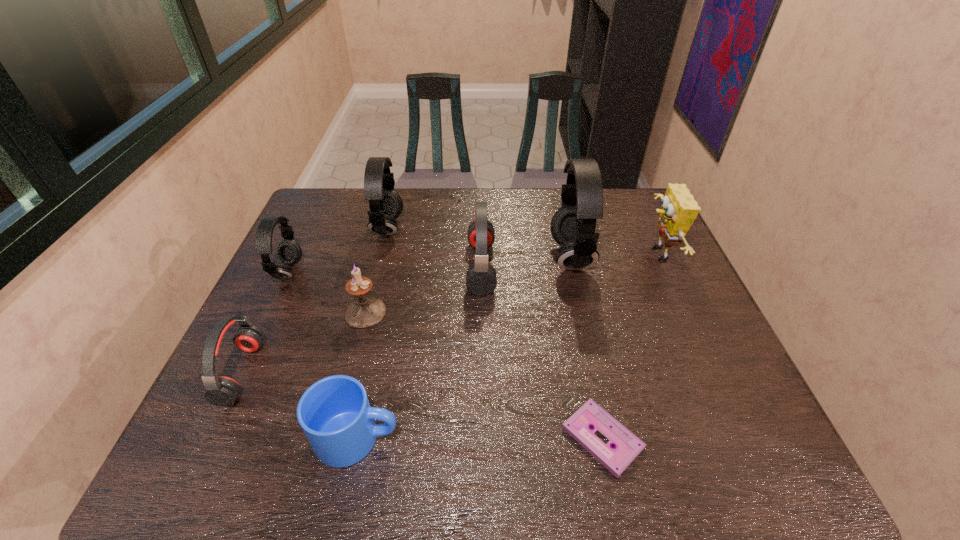
Locate an element on the screen. The image size is (960, 540). the tallest object is located at coordinates (573, 225).

This screenshot has width=960, height=540. In order to click on the biggest black earphone in this screenshot , I will do click(573, 225).

Image resolution: width=960 pixels, height=540 pixels. What are the coordinates of `the fourth shortest earphone` in the screenshot? It's located at (386, 205).

You are a GUI agent. You are given a task and a screenshot of the screen. Output one action in this format:
    pyautogui.click(x=<x>, y=<y>)
    Task: Click on the second smallest black earphone
    
    Given the screenshot: What is the action you would take?
    pyautogui.click(x=386, y=205)

Where is `yellow sponge`? yellow sponge is located at coordinates (679, 209).

Where is `the rightmost object`? the rightmost object is located at coordinates (679, 209).

This screenshot has width=960, height=540. What are the coordinates of `the right red earphone` in the screenshot? It's located at (481, 280).

You are a GUI agent. You are given a task and a screenshot of the screen. Output one action in this format:
    pyautogui.click(x=<x>, y=<y>)
    Task: Click on the sixth object from left to right
    The image size is (960, 540).
    Given the screenshot: What is the action you would take?
    pos(481,280)

You are a GUI agent. You are given a task and a screenshot of the screen. Output one action in this format:
    pyautogui.click(x=<x>, y=<y>)
    Task: Click on the smallest black earphone
    
    Given the screenshot: What is the action you would take?
    pyautogui.click(x=289, y=252)

At what (x,y) coordinates should I click in order to perform the action: click on purple candle holder. Please return your answer as a coordinate pair (x, y). The width and height of the screenshot is (960, 540). Looking at the image, I should click on (365, 312).